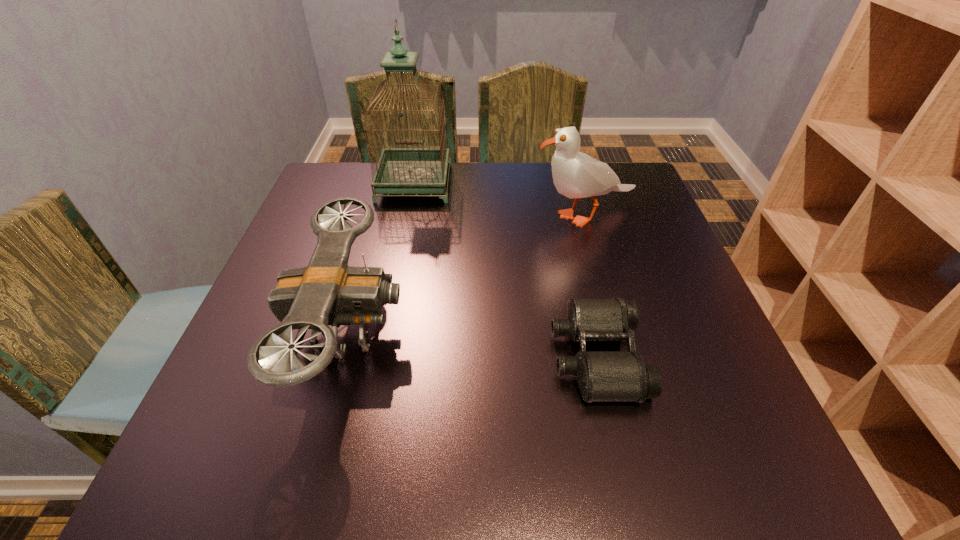
The height and width of the screenshot is (540, 960). Identify the location of vacant region at the far edge. (543, 195).

In the image, there is a desktop. Where is `free space at the near edge`? The width and height of the screenshot is (960, 540). free space at the near edge is located at coordinates (432, 486).

You are a GUI agent. You are given a task and a screenshot of the screen. Output one action in this format:
    pyautogui.click(x=<x>, y=<y>)
    Task: Click on the blank space at the left edge of the desktop
    The width and height of the screenshot is (960, 540).
    Given the screenshot: What is the action you would take?
    pyautogui.click(x=316, y=377)

Identify the location of vacant space at the right edge. (628, 212).

The height and width of the screenshot is (540, 960). I want to click on vacant space at the far right corner of the desktop, so click(x=629, y=181).

This screenshot has height=540, width=960. In the image, there is a desktop. Identify the location of vacant area at the near right corner. (706, 446).

At what (x,y) coordinates should I click in order to perform the action: click on free space between the binoculars and the gull. Please return your answer as a coordinate pair (x, y). Image resolution: width=960 pixels, height=540 pixels. Looking at the image, I should click on coord(590,286).

The height and width of the screenshot is (540, 960). In order to click on empty location between the birdcage and the gull in this screenshot , I will do `click(499, 200)`.

You are a GUI agent. You are given a task and a screenshot of the screen. Output one action in this format:
    pyautogui.click(x=<x>, y=<y>)
    Task: Click on the vacant area that lies between the binoculars and the third tallest object
    Image resolution: width=960 pixels, height=540 pixels.
    Given the screenshot: What is the action you would take?
    pyautogui.click(x=472, y=343)

Where is `vacant area that lies between the gull and the binoculars`? The height and width of the screenshot is (540, 960). vacant area that lies between the gull and the binoculars is located at coordinates (590, 286).